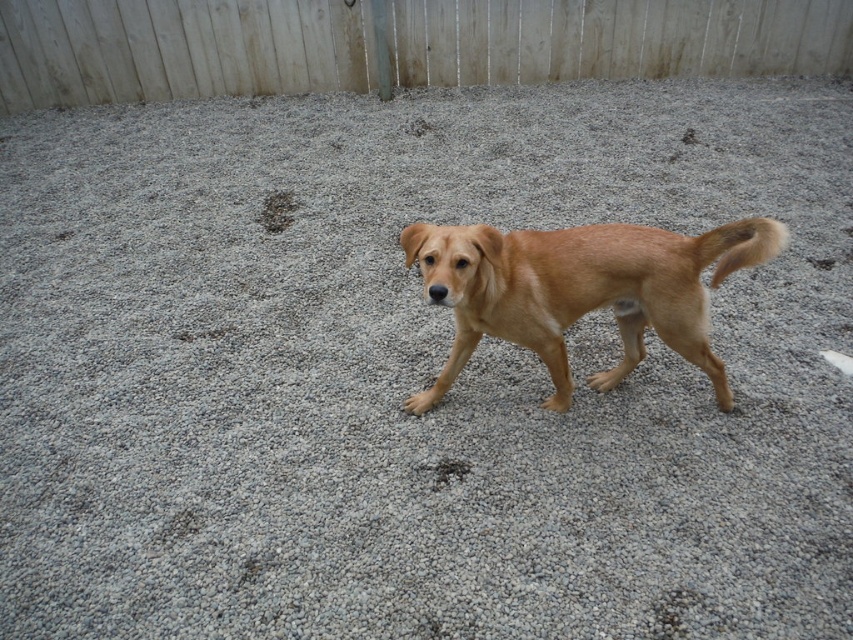
Question: Does white wooden fence at upper center have a larger size compared to golden fur dog at center?

Choices:
 (A) yes
 (B) no

Answer: (A)

Question: Which point is farther from the camera taking this photo?

Choices:
 (A) (491, 234)
 (B) (160, 20)

Answer: (B)

Question: Which point is farther from the camera taking this photo?

Choices:
 (A) (508, 232)
 (B) (698, 74)

Answer: (B)

Question: Observing the image, what is the correct spatial positioning of white wooden fence at upper center in reference to golden fur dog at center?

Choices:
 (A) right
 (B) left

Answer: (A)

Question: Is white wooden fence at upper center wider than golden fur dog at center?

Choices:
 (A) no
 (B) yes

Answer: (B)

Question: Which object appears closest to the camera in this image?

Choices:
 (A) white wooden fence at upper center
 (B) golden fur dog at center

Answer: (B)